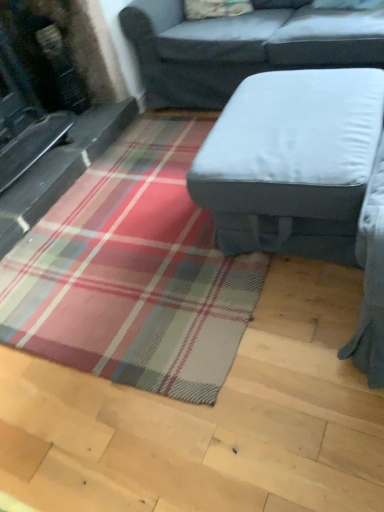
Describe the element at coordinates (304, 180) in the screenshot. I see `light gray fabric ottoman at center, arranged as the first studio couch when ordered from the bottom` at that location.

You are a GUI agent. You are given a task and a screenshot of the screen. Output one action in this format:
    pyautogui.click(x=<x>, y=<y>)
    Task: Click on the light gray fabric ottoman at center, arranged as the first studio couch when ordered from the bottom
    
    Given the screenshot: What is the action you would take?
    pyautogui.click(x=304, y=180)

I want to click on gray fabric studio couch at center, the second studio couch from the bottom, so click(x=242, y=46).

What do you see at coordinates (242, 46) in the screenshot? The height and width of the screenshot is (512, 384). I see `gray fabric studio couch at center, the 1th studio couch when ordered from top to bottom` at bounding box center [242, 46].

Identify the location of light gray fabric ottoman at center, arranged as the first studio couch when ordered from the bottom. The width and height of the screenshot is (384, 512). (304, 180).

Does gray fabric studio couch at center, the second studio couch from the bottom, appear on the left side of light gray fabric ottoman at center, which is the second studio couch from top to bottom?

In fact, gray fabric studio couch at center, the second studio couch from the bottom, is to the right of light gray fabric ottoman at center, which is the second studio couch from top to bottom.

Considering the relative positions of gray fabric studio couch at center, the second studio couch from the bottom, and light gray fabric ottoman at center, which is the second studio couch from top to bottom, in the image provided, is gray fabric studio couch at center, the second studio couch from the bottom, in front of light gray fabric ottoman at center, which is the second studio couch from top to bottom,?

No, gray fabric studio couch at center, the second studio couch from the bottom, is behind light gray fabric ottoman at center, which is the second studio couch from top to bottom.

Is point (316, 50) positioned before point (366, 135)?

No, (316, 50) is further to viewer.

From the image's perspective, would you say gray fabric studio couch at center, the second studio couch from the bottom, is positioned over light gray fabric ottoman at center, arranged as the first studio couch when ordered from the bottom?

Yes, from the image's perspective, gray fabric studio couch at center, the second studio couch from the bottom, is on top of light gray fabric ottoman at center, arranged as the first studio couch when ordered from the bottom.

From a real-world perspective, is gray fabric studio couch at center, the second studio couch from the bottom, physically below light gray fabric ottoman at center, which is the second studio couch from top to bottom?

Actually, gray fabric studio couch at center, the second studio couch from the bottom, is physically above light gray fabric ottoman at center, which is the second studio couch from top to bottom, in the real world.

Considering the sizes of gray fabric studio couch at center, the second studio couch from the bottom, and light gray fabric ottoman at center, arranged as the first studio couch when ordered from the bottom, in the image, is gray fabric studio couch at center, the second studio couch from the bottom, wider or thinner than light gray fabric ottoman at center, arranged as the first studio couch when ordered from the bottom,?

gray fabric studio couch at center, the second studio couch from the bottom, is wider than light gray fabric ottoman at center, arranged as the first studio couch when ordered from the bottom.

Can you confirm if gray fabric studio couch at center, the 1th studio couch when ordered from top to bottom, is shorter than light gray fabric ottoman at center, which is the second studio couch from top to bottom?

In fact, gray fabric studio couch at center, the 1th studio couch when ordered from top to bottom, may be taller than light gray fabric ottoman at center, which is the second studio couch from top to bottom.

Looking at the image, does gray fabric studio couch at center, the second studio couch from the bottom, seem bigger or smaller compared to light gray fabric ottoman at center, which is the second studio couch from top to bottom?

In the image, gray fabric studio couch at center, the second studio couch from the bottom, appears to be larger than light gray fabric ottoman at center, which is the second studio couch from top to bottom.

Consider the image. Is gray fabric studio couch at center, the 1th studio couch when ordered from top to bottom, outside of light gray fabric ottoman at center, arranged as the first studio couch when ordered from the bottom?

gray fabric studio couch at center, the 1th studio couch when ordered from top to bottom, lies outside light gray fabric ottoman at center, arranged as the first studio couch when ordered from the bottom,'s area.

Is gray fabric studio couch at center, the 1th studio couch when ordered from top to bottom, next to light gray fabric ottoman at center, which is the second studio couch from top to bottom, and touching it?

No, gray fabric studio couch at center, the 1th studio couch when ordered from top to bottom, is not making contact with light gray fabric ottoman at center, which is the second studio couch from top to bottom.

Could you tell me if gray fabric studio couch at center, the 1th studio couch when ordered from top to bottom, is facing light gray fabric ottoman at center, arranged as the first studio couch when ordered from the bottom?

Yes, gray fabric studio couch at center, the 1th studio couch when ordered from top to bottom, is oriented towards light gray fabric ottoman at center, arranged as the first studio couch when ordered from the bottom.

How many degrees apart are the facing directions of gray fabric studio couch at center, the second studio couch from the bottom, and light gray fabric ottoman at center, which is the second studio couch from top to bottom?

The facing directions of gray fabric studio couch at center, the second studio couch from the bottom, and light gray fabric ottoman at center, which is the second studio couch from top to bottom, are 87.4 degrees apart.

Could you measure the distance between gray fabric studio couch at center, the second studio couch from the bottom, and light gray fabric ottoman at center, which is the second studio couch from top to bottom?

They are 32.31 inches apart.

The image size is (384, 512). What are the coordinates of `studio couch that is behind the light gray fabric ottoman at center, which is the second studio couch from top to bottom` in the screenshot? It's located at (242, 46).

Does light gray fabric ottoman at center, which is the second studio couch from top to bottom, appear on the left side of gray fabric studio couch at center, the second studio couch from the bottom?

Indeed, light gray fabric ottoman at center, which is the second studio couch from top to bottom, is positioned on the left side of gray fabric studio couch at center, the second studio couch from the bottom.

Is the position of light gray fabric ottoman at center, which is the second studio couch from top to bottom, less distant than that of gray fabric studio couch at center, the second studio couch from the bottom?

Yes, it is.

Between point (335, 104) and point (239, 68), which one is positioned in front?

The point (335, 104) is in front.

From the image's perspective, who appears lower, light gray fabric ottoman at center, which is the second studio couch from top to bottom, or gray fabric studio couch at center, the second studio couch from the bottom?

light gray fabric ottoman at center, which is the second studio couch from top to bottom, is shown below in the image.

From a real-world perspective, is light gray fabric ottoman at center, which is the second studio couch from top to bottom, beneath gray fabric studio couch at center, the 1th studio couch when ordered from top to bottom?

Indeed, from a real-world perspective, light gray fabric ottoman at center, which is the second studio couch from top to bottom, is positioned beneath gray fabric studio couch at center, the 1th studio couch when ordered from top to bottom.

Between light gray fabric ottoman at center, arranged as the first studio couch when ordered from the bottom, and gray fabric studio couch at center, the 1th studio couch when ordered from top to bottom, which one has smaller width?

With smaller width is light gray fabric ottoman at center, arranged as the first studio couch when ordered from the bottom.

Does light gray fabric ottoman at center, arranged as the first studio couch when ordered from the bottom, have a lesser height compared to gray fabric studio couch at center, the 1th studio couch when ordered from top to bottom?

Yes.

Between light gray fabric ottoman at center, arranged as the first studio couch when ordered from the bottom, and gray fabric studio couch at center, the 1th studio couch when ordered from top to bottom, which one has larger size?

gray fabric studio couch at center, the 1th studio couch when ordered from top to bottom.

Do you think light gray fabric ottoman at center, which is the second studio couch from top to bottom, is within gray fabric studio couch at center, the second studio couch from the bottom, or outside of it?

light gray fabric ottoman at center, which is the second studio couch from top to bottom, is outside gray fabric studio couch at center, the second studio couch from the bottom.

Is light gray fabric ottoman at center, arranged as the first studio couch when ordered from the bottom, facing away from gray fabric studio couch at center, the second studio couch from the bottom?

No, light gray fabric ottoman at center, arranged as the first studio couch when ordered from the bottom, is not facing away from gray fabric studio couch at center, the second studio couch from the bottom.

What's the angular difference between light gray fabric ottoman at center, arranged as the first studio couch when ordered from the bottom, and gray fabric studio couch at center, the 1th studio couch when ordered from top to bottom,'s facing directions?

There is a 87.4-degree angle between the facing directions of light gray fabric ottoman at center, arranged as the first studio couch when ordered from the bottom, and gray fabric studio couch at center, the 1th studio couch when ordered from top to bottom.

You are a GUI agent. You are given a task and a screenshot of the screen. Output one action in this format:
    pyautogui.click(x=<x>, y=<y>)
    Task: Click on the studio couch that is below the gray fabric studio couch at center, the second studio couch from the bottom (from the image's perspective)
    This screenshot has height=512, width=384.
    Given the screenshot: What is the action you would take?
    pyautogui.click(x=304, y=180)

Find the location of a particular element. This screenshot has height=512, width=384. studio couch that appears behind the light gray fabric ottoman at center, arranged as the first studio couch when ordered from the bottom is located at coordinates (242, 46).

Identify the location of studio couch located above the light gray fabric ottoman at center, which is the second studio couch from top to bottom (from a real-world perspective). This screenshot has height=512, width=384. (242, 46).